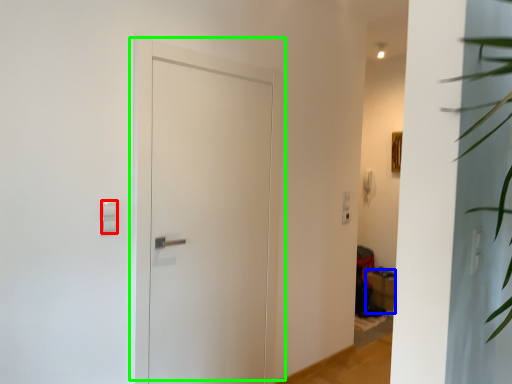
Question: Which object is the farthest from light switch (highlighted by a red box)? Choose among these: furniture (highlighted by a blue box) or door (highlighted by a green box).

Choices:
 (A) furniture
 (B) door

Answer: (A)